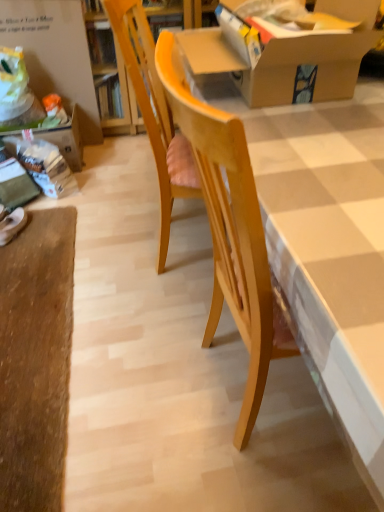
You are a GUI agent. You are given a task and a screenshot of the screen. Output one action in this format:
    pyautogui.click(x=<x>, y=<y>)
    Task: Click on the wooden table at center
    
    Given the screenshot: What is the action you would take?
    pyautogui.click(x=327, y=246)

Is white cardboard at upper left next to light wood chair at center and touching it?

No, white cardboard at upper left is not in contact with light wood chair at center.

Is white cardboard at upper left oriented towards light wood chair at center?

Yes, white cardboard at upper left is facing light wood chair at center.

Which point is more distant from viewer, (25, 59) or (162, 246)?

The point (25, 59) is farther from the camera.

What's the angular difference between white cardboard at upper left and light wood chair at center's facing directions?

There is a 75.6-degree angle between the facing directions of white cardboard at upper left and light wood chair at center.

Does cardboard box at upper center have a greater width compared to white matte shoe at lower left?

Indeed, cardboard box at upper center has a greater width compared to white matte shoe at lower left.

In the scene shown: Is cardboard box at upper center spatially inside white matte shoe at lower left, or outside of it?

cardboard box at upper center cannot be found inside white matte shoe at lower left.

From the picture: From a real-world perspective, is cardboard box at upper center on white matte shoe at lower left?

Indeed, from a real-world perspective, cardboard box at upper center stands above white matte shoe at lower left.

Is cardboard box at upper center not close to white matte shoe at lower left?

cardboard box at upper center is positioned a significant distance from white matte shoe at lower left.

From their relative heights in the image, would you say wooden table at center is taller or shorter than cardboard box at upper center?

Clearly, wooden table at center is taller compared to cardboard box at upper center.

In the scene shown: What's the angular difference between wooden table at center and cardboard box at upper center's facing directions?

89.9 degrees separate the facing orientations of wooden table at center and cardboard box at upper center.

Between wooden table at center and cardboard box at upper center, which one appears on the right side from the viewer's perspective?

wooden table at center.

Is wooden table at center wider or thinner than cardboard box at upper center?

Considering their sizes, wooden table at center looks broader than cardboard box at upper center.

Consider the image. Is cardboard box at upper center located outside light wood chair at center?

Actually, cardboard box at upper center is within light wood chair at center.

Which object is further away from the camera, cardboard box at upper center or light wood chair at center?

light wood chair at center is more distant.

Which is behind, point (259, 51) or point (146, 72)?

The point (146, 72) is behind.

Can you confirm if cardboard box at upper center is positioned to the left of light wood chair at center?

No.

Is white matte shoe at lower left not within cardboard box at upper center?

Indeed, white matte shoe at lower left is completely outside cardboard box at upper center.

How much distance is there between white matte shoe at lower left and cardboard box at upper center?

white matte shoe at lower left and cardboard box at upper center are 1.39 meters apart from each other.

Is white matte shoe at lower left aimed at cardboard box at upper center?

No, white matte shoe at lower left is not turned towards cardboard box at upper center.

Is white matte shoe at lower left shorter than cardboard box at upper center?

Yes, white matte shoe at lower left is shorter than cardboard box at upper center.

In the scene shown: Considering the relative positions of light wood chair at center and white cardboard at upper left in the image provided, is light wood chair at center to the left or to the right of white cardboard at upper left?

In the image, light wood chair at center appears on the right side of white cardboard at upper left.

Are light wood chair at center and white cardboard at upper left beside each other?

No, light wood chair at center is not next to white cardboard at upper left.

Considering the sizes of objects light wood chair at center and white cardboard at upper left in the image provided, who is shorter, light wood chair at center or white cardboard at upper left?

white cardboard at upper left is shorter.

Which is nearer, (144, 27) or (48, 73)?

The point (144, 27) is in front.

Is cardboard box at upper center oriented away from wooden table at center?

No, wooden table at center is not at the back of cardboard box at upper center.

Is cardboard box at upper center taller or shorter than wooden table at center?

In the image, cardboard box at upper center appears to be shorter than wooden table at center.

Would you say cardboard box at upper center is a long distance from wooden table at center?

cardboard box at upper center is near wooden table at center, not far away.

Based on the photo, from the image's perspective, is cardboard box at upper center located above wooden table at center?

Yes, from the image's perspective, cardboard box at upper center is over wooden table at center.

Find the location of a particular element. chair below the white cardboard at upper left (from the image's perspective) is located at coordinates (148, 102).

Where is `box above the white matte shoe at lower left (from a real-world perspective)`? The height and width of the screenshot is (512, 384). box above the white matte shoe at lower left (from a real-world perspective) is located at coordinates (282, 50).

Looking at the image, which one is located closer to cardboard box at upper center, white cardboard at upper left or wooden table at center?

wooden table at center is positioned closer to the anchor cardboard box at upper center.

Considering their positions, is white cardboard at upper left positioned closer to white matte shoe at lower left than wooden table at center?

Among the two, white cardboard at upper left is located nearer to white matte shoe at lower left.

Based on their spatial positions, is white matte shoe at lower left or white cardboard at upper left further from cardboard box at upper center?

The object further to cardboard box at upper center is white cardboard at upper left.

Based on their spatial positions, is cardboard box at upper center or white cardboard at upper left further from light wood chair at center?

white cardboard at upper left.

When comparing their distances from wooden table at center, does white cardboard at upper left or white matte shoe at lower left seem closer?

white matte shoe at lower left.

Looking at the image, which one is located further to cardboard box at upper center, light wood chair at center or white matte shoe at lower left?

The object further to cardboard box at upper center is white matte shoe at lower left.

Looking at this image, estimate the real-world distances between objects in this image. Which object is closer to white cardboard at upper left, cardboard box at upper center or white matte shoe at lower left?

The object closer to white cardboard at upper left is white matte shoe at lower left.

Considering their positions, is cardboard box at upper center positioned closer to wooden table at center than white matte shoe at lower left?

cardboard box at upper center is positioned closer to the anchor wooden table at center.

Where is `footwear positioned between wooden table at center and white cardboard at upper left from near to far`? The width and height of the screenshot is (384, 512). footwear positioned between wooden table at center and white cardboard at upper left from near to far is located at coordinates (12, 225).

Identify the location of chair between white matte shoe at lower left and wooden table at center. Image resolution: width=384 pixels, height=512 pixels. (148, 102).

The width and height of the screenshot is (384, 512). What are the coordinates of `box located between light wood chair at center and wooden table at center in the left-right direction` in the screenshot? It's located at (282, 50).

At what (x,y) coordinates should I click in order to perform the action: click on box located between white matte shoe at lower left and wooden table at center in the left-right direction. Please return your answer as a coordinate pair (x, y). This screenshot has height=512, width=384. Looking at the image, I should click on (282, 50).